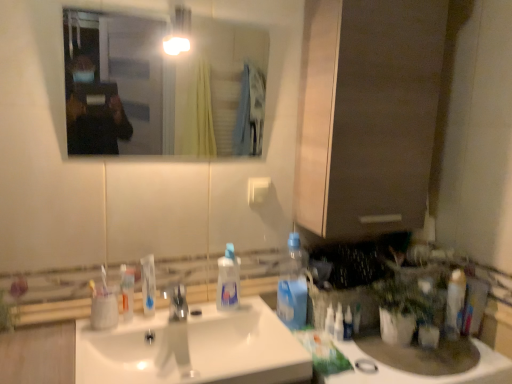
What are the coordinates of `free location to the right of white plastic toothpaste tube at lower right, which appears as the first toiletry when viewed from the left` in the screenshot? It's located at (386, 349).